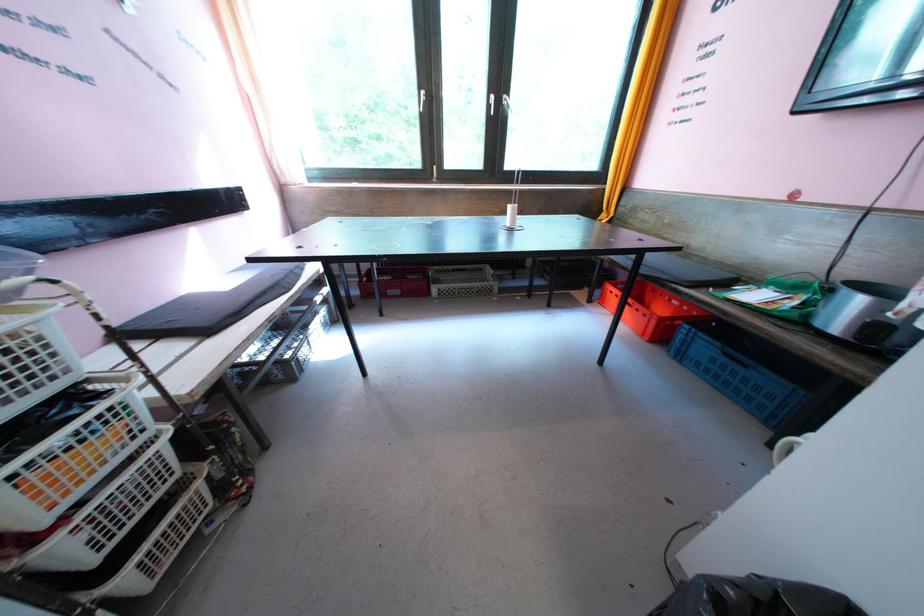
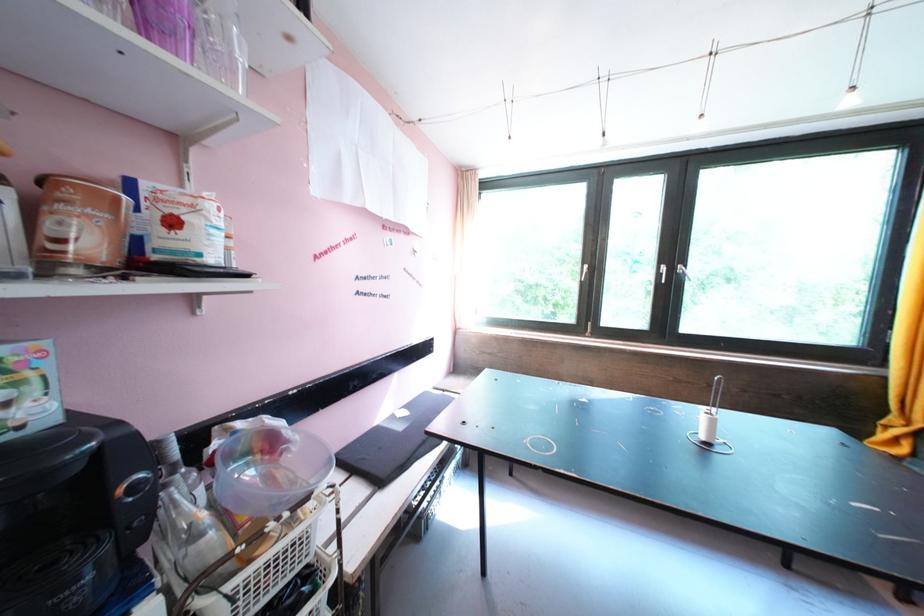
In the second image, find the point that corresponds to point 506,103 in the first image.

(679, 273)